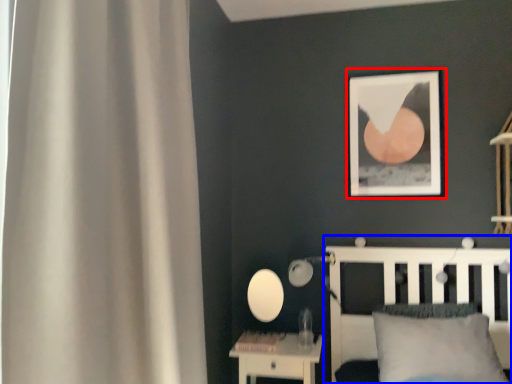
Question: Among these objects, which one is farthest to the camera, picture frame (highlighted by a red box) or bed (highlighted by a blue box)?

Choices:
 (A) picture frame
 (B) bed

Answer: (A)